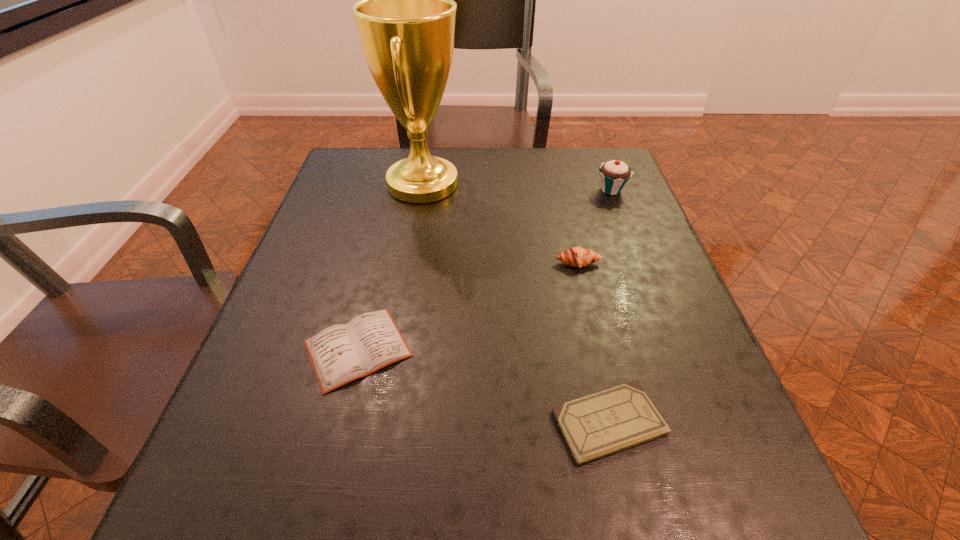
The width and height of the screenshot is (960, 540). Find the location of `vacant space situated 0.110m on the back of the diary`. vacant space situated 0.110m on the back of the diary is located at coordinates (377, 270).

The image size is (960, 540). I want to click on vacant space located 0.060m on the left of the checkbook, so click(514, 422).

The height and width of the screenshot is (540, 960). Find the location of `award situated at the far edge`. award situated at the far edge is located at coordinates (406, 16).

Where is `cupcake that is at the far edge`? This screenshot has width=960, height=540. cupcake that is at the far edge is located at coordinates (614, 174).

This screenshot has height=540, width=960. Identify the location of award situated at the left edge. (406, 16).

Locate an element on the screen. diary situated at the left edge is located at coordinates (341, 353).

I want to click on cupcake present at the right edge, so click(614, 174).

Where is `pastry located in the right edge section of the desktop`? The image size is (960, 540). pastry located in the right edge section of the desktop is located at coordinates (578, 257).

Where is `checkbook at the right edge`? This screenshot has height=540, width=960. checkbook at the right edge is located at coordinates (618, 418).

You are a GUI agent. You are given a task and a screenshot of the screen. Output one action in this format:
    pyautogui.click(x=<x>, y=<y>)
    Task: Click on the object that is at the far left corner
    The width and height of the screenshot is (960, 540).
    Given the screenshot: What is the action you would take?
    click(x=406, y=16)